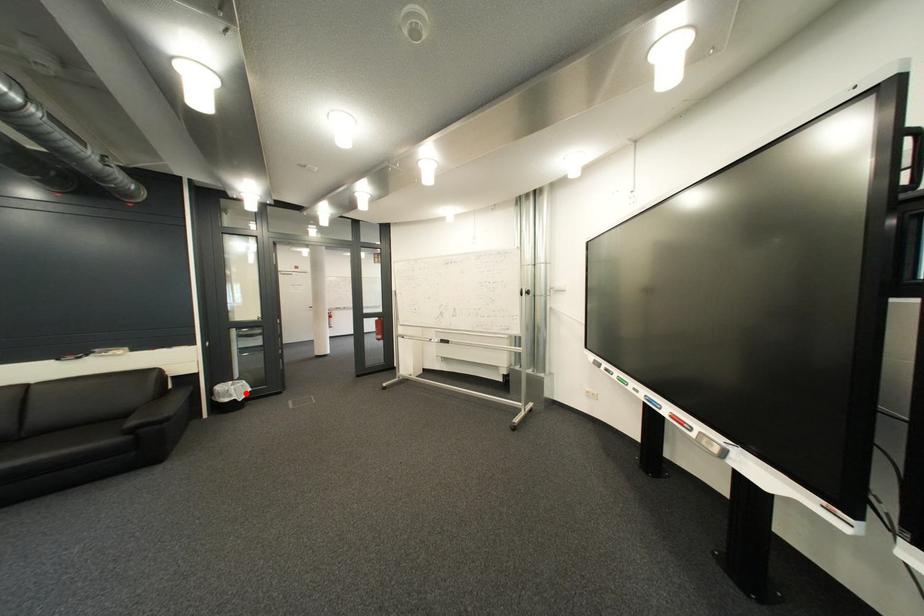
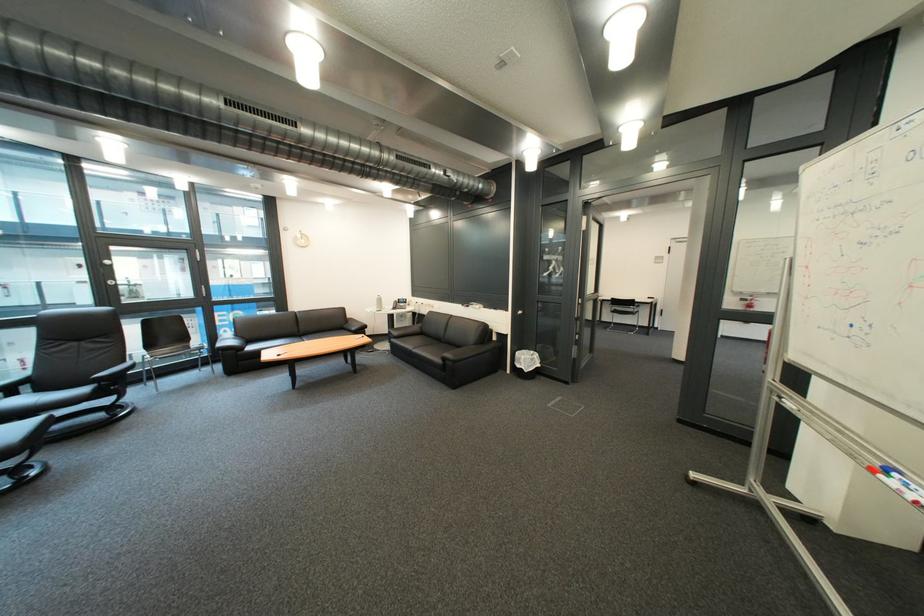
Locate, in the second image, the point that corresponds to the highlighted location in the first image.

(536, 363)